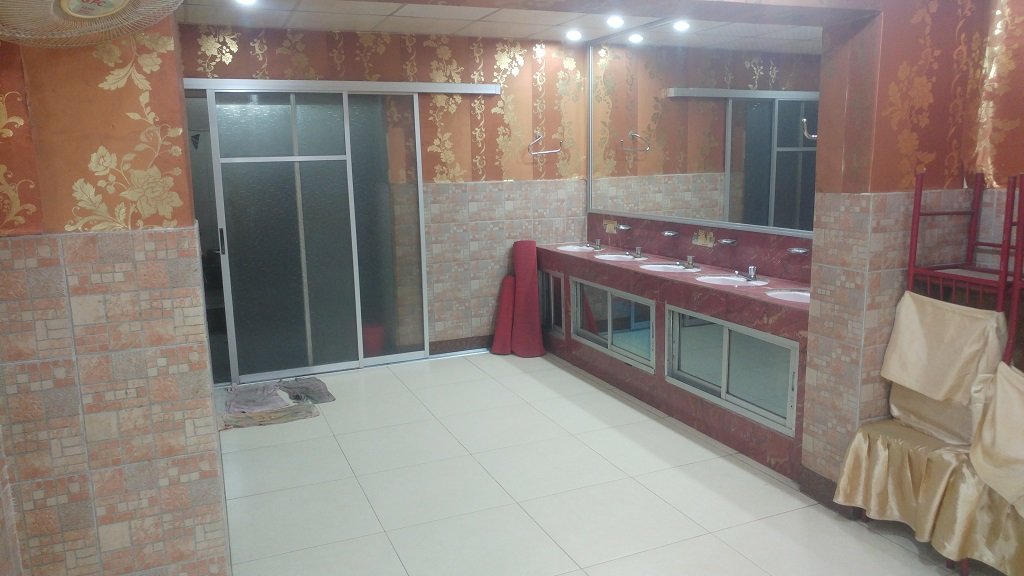
You are a GUI agent. You are given a task and a screenshot of the screen. Output one action in this format:
    pyautogui.click(x=<x>, y=<y>)
    Task: Click on the reflection of sliding door
    
    Given the screenshot: What is the action you would take?
    pyautogui.click(x=794, y=165)